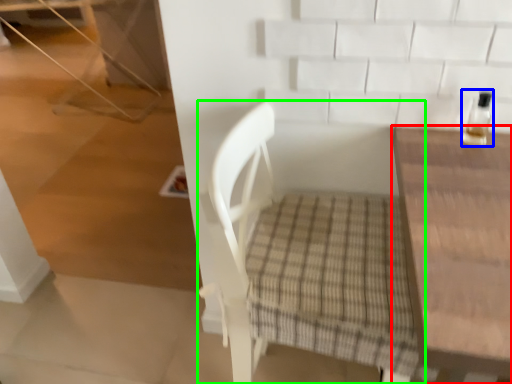
Question: Which object is the closest to the table (highlighted by a red box)? Choose among these: bottle (highlighted by a blue box) or chair (highlighted by a green box).

Choices:
 (A) bottle
 (B) chair

Answer: (A)